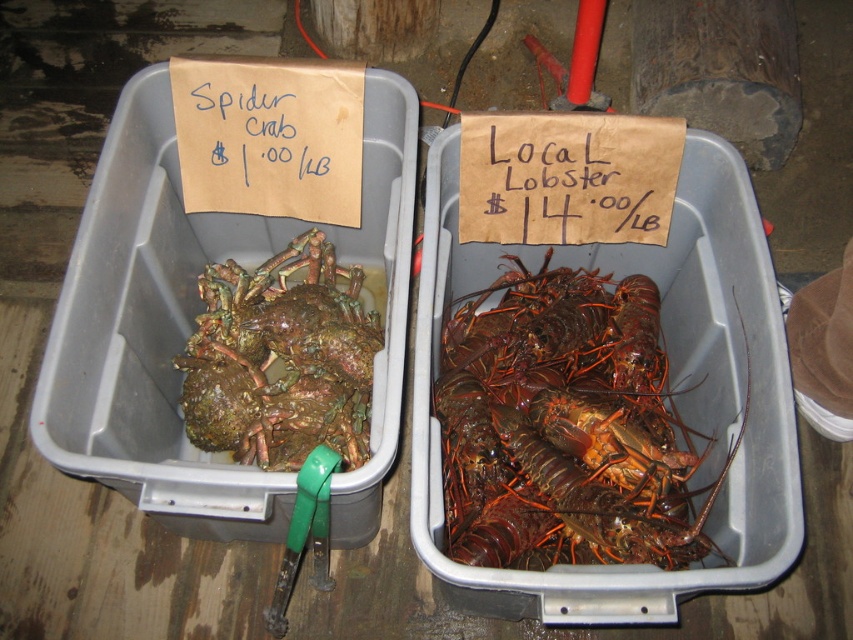
Which of these two, shiny orange lobster at right or greenish-brown crustacean at center-left, stands shorter?

greenish-brown crustacean at center-left is shorter.

Does point (596, 280) come closer to viewer compared to point (294, 253)?

Yes, it is in front of point (294, 253).

Where is `shiny orange lobster at right`? This screenshot has width=853, height=640. shiny orange lobster at right is located at coordinates (564, 424).

This screenshot has height=640, width=853. In order to click on shiny orange lobster at right in this screenshot , I will do `click(564, 424)`.